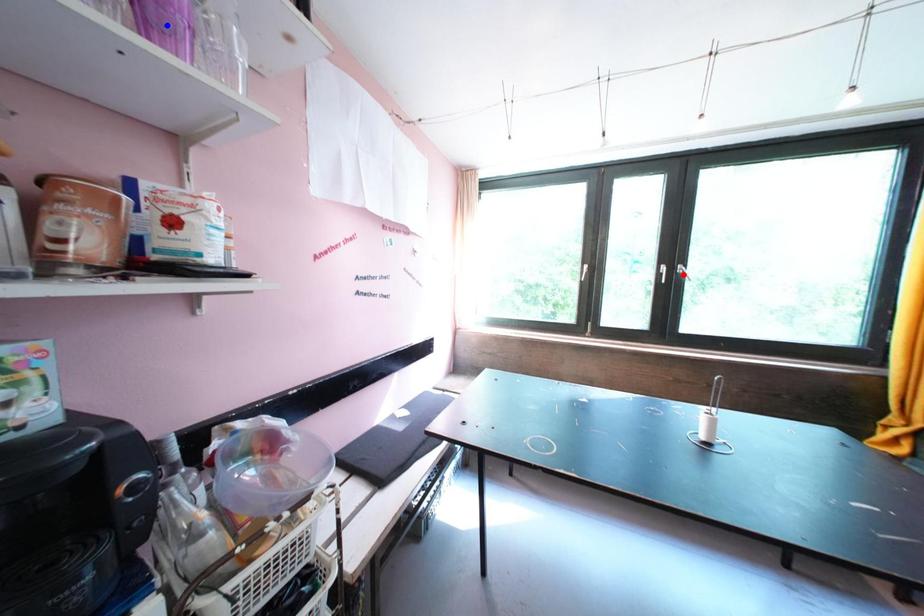
Question: Which of the two points in the image is closer to the camera?

Choices:
 (A) Blue point is closer.
 (B) Red point is closer.

Answer: (A)